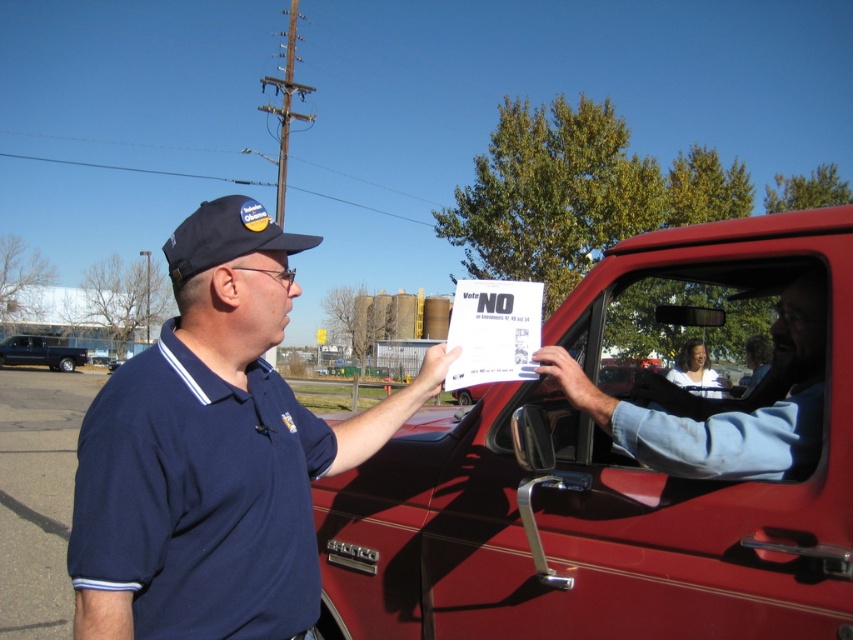
Does matte blue shirt at center come in front of denim shirt at center?

Yes, it is.

Where is `matte blue shirt at center`? Image resolution: width=853 pixels, height=640 pixels. matte blue shirt at center is located at coordinates (213, 452).

At what (x,y) coordinates should I click in order to perform the action: click on matte blue shirt at center. Please return your answer as a coordinate pair (x, y). Image resolution: width=853 pixels, height=640 pixels. Looking at the image, I should click on (213, 452).

Which of these two, denim shirt at center or black matte van at left, stands shorter?

Standing shorter between the two is denim shirt at center.

In the scene shown: Is denim shirt at center above black matte van at left?

Yes.

Is point (666, 410) farther from camera compared to point (73, 353)?

No, (666, 410) is closer to viewer.

Where is `denim shirt at center`? Image resolution: width=853 pixels, height=640 pixels. denim shirt at center is located at coordinates (720, 404).

Is matte blue shirt at center positioned behind black matte van at left?

No, matte blue shirt at center is in front of black matte van at left.

Is matte blue shirt at center bigger than black matte van at left?

Actually, matte blue shirt at center might be smaller than black matte van at left.

Measure the distance between point (291,432) and camera.

A distance of 5.48 feet exists between point (291,432) and camera.

The width and height of the screenshot is (853, 640). Find the location of `matte blue shirt at center`. matte blue shirt at center is located at coordinates (213, 452).